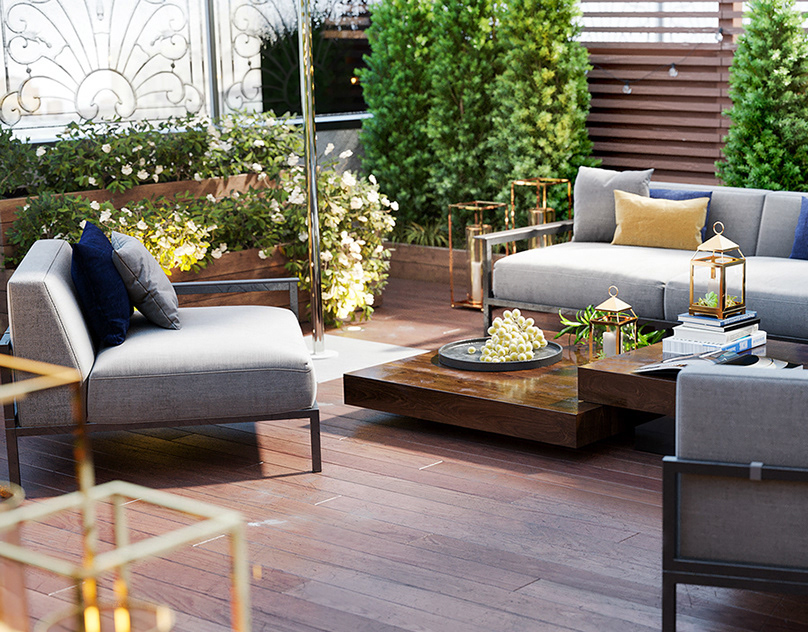
The height and width of the screenshot is (632, 808). What are the coordinates of `chairs` in the screenshot? It's located at [182, 372], [760, 428].